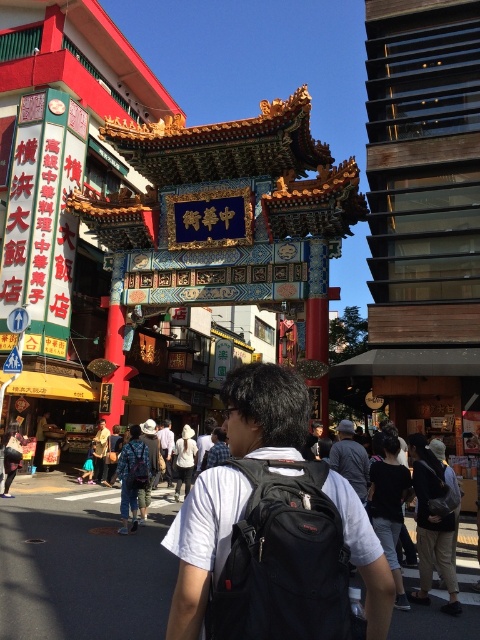
Question: Estimate the real-world distances between objects in this image. Which object is closer to the white shirt at center?

Choices:
 (A) light brown leather jacket at center
 (B) dark gray fabric jacket at center

Answer: (A)

Question: Estimate the real-world distances between objects in this image. Which object is closer to the white shirt at center?

Choices:
 (A) dark gray fabric jacket at center
 (B) black fabric backpack at center
 (C) black backpack at center

Answer: (A)

Question: Does black backpack at center have a smaller size compared to dark gray fabric jacket at center?

Choices:
 (A) yes
 (B) no

Answer: (B)

Question: Does black fabric backpack at center appear under white shirt at center?

Choices:
 (A) no
 (B) yes

Answer: (A)

Question: Can you confirm if dark gray fabric jacket at center is bigger than light brown leather jacket at center?

Choices:
 (A) no
 (B) yes

Answer: (B)

Question: Which point is closer to the camera taking this photo?

Choices:
 (A) (360, 468)
 (B) (347, 609)
 (C) (255, 600)

Answer: (C)